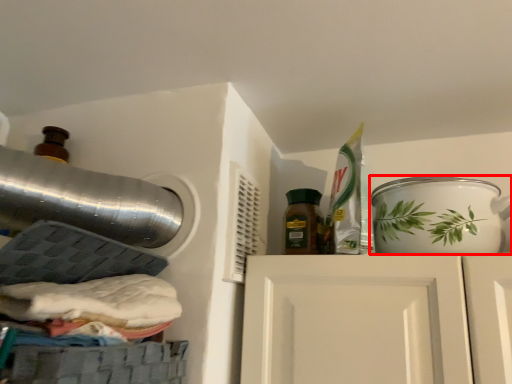
Question: From the image, what is the correct spatial relationship of tableware (annotated by the red box) in relation to bottle?

Choices:
 (A) right
 (B) left

Answer: (A)